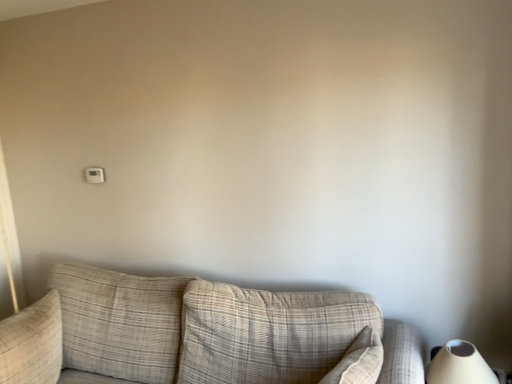
Question: From the image's perspective, would you say beige plaid couch at center is shown under white plastic thermostat at upper left?

Choices:
 (A) yes
 (B) no

Answer: (A)

Question: Considering the relative sizes of beige plaid couch at center and white plastic thermostat at upper left in the image provided, is beige plaid couch at center shorter than white plastic thermostat at upper left?

Choices:
 (A) yes
 (B) no

Answer: (B)

Question: Is beige plaid couch at center in front of white plastic thermostat at upper left?

Choices:
 (A) no
 (B) yes

Answer: (B)

Question: Is beige plaid couch at center positioned far away from white plastic thermostat at upper left?

Choices:
 (A) yes
 (B) no

Answer: (A)

Question: Is beige plaid couch at center bigger than white plastic thermostat at upper left?

Choices:
 (A) no
 (B) yes

Answer: (B)

Question: From a real-world perspective, is beige plaid couch at center physically below white plastic thermostat at upper left?

Choices:
 (A) yes
 (B) no

Answer: (A)

Question: Does white matte table lamp at lower right have a larger size compared to white plastic thermostat at upper left?

Choices:
 (A) yes
 (B) no

Answer: (A)

Question: From a real-world perspective, does white matte table lamp at lower right sit lower than white plastic thermostat at upper left?

Choices:
 (A) yes
 (B) no

Answer: (A)

Question: Considering the relative positions of white matte table lamp at lower right and white plastic thermostat at upper left in the image provided, is white matte table lamp at lower right to the left of white plastic thermostat at upper left from the viewer's perspective?

Choices:
 (A) no
 (B) yes

Answer: (A)

Question: From the image's perspective, would you say white matte table lamp at lower right is shown under white plastic thermostat at upper left?

Choices:
 (A) yes
 (B) no

Answer: (A)

Question: Considering the relative positions of white matte table lamp at lower right and white plastic thermostat at upper left in the image provided, is white matte table lamp at lower right to the right of white plastic thermostat at upper left from the viewer's perspective?

Choices:
 (A) yes
 (B) no

Answer: (A)

Question: Can you confirm if white matte table lamp at lower right is shorter than white plastic thermostat at upper left?

Choices:
 (A) no
 (B) yes

Answer: (A)

Question: From the image's perspective, is beige plaid couch at center below beige textured pillow at left?

Choices:
 (A) no
 (B) yes

Answer: (B)